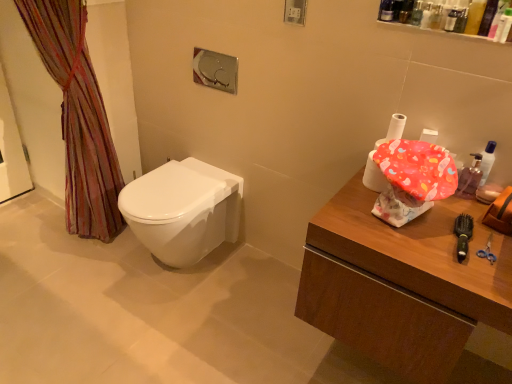
This screenshot has height=384, width=512. What are the coordinates of `blank area to the left of matte pink fabric toilet paper at right` in the screenshot? It's located at (350, 192).